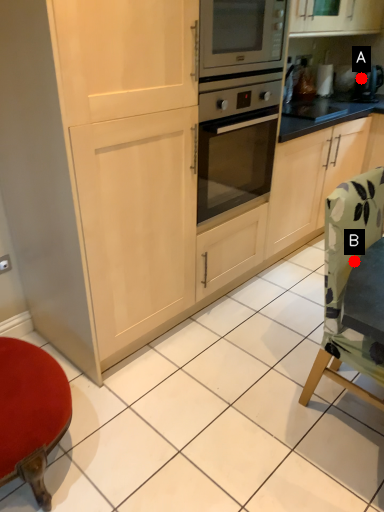
Question: Two points are circled on the image, labeled by A and B beside each circle. Among these points, which one is nearest to the camera?

Choices:
 (A) A is closer
 (B) B is closer

Answer: (B)